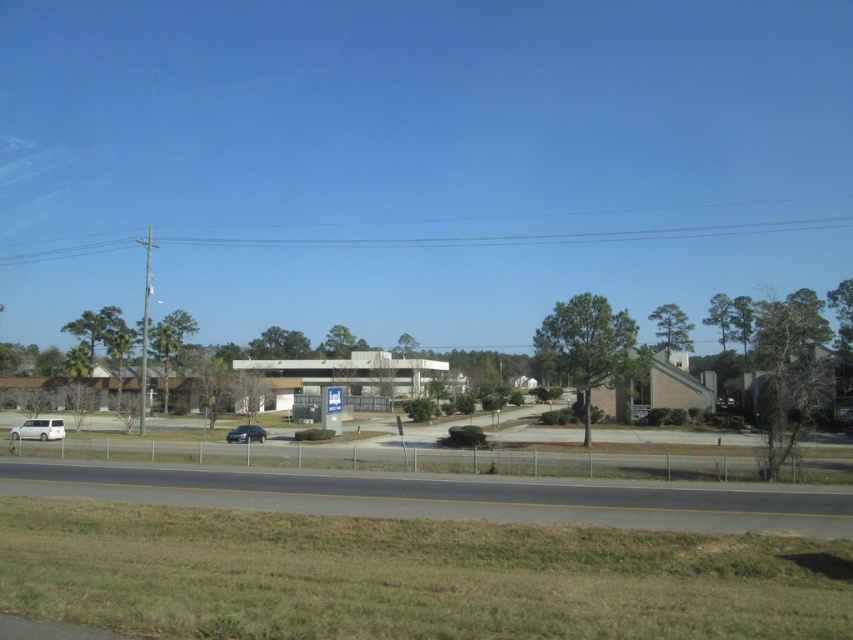
Based on the photo, who is more distant from viewer, (44,426) or (248,440)?

The point (44,426) is more distant.

Is point (22, 420) in front of point (231, 433)?

No, (22, 420) is further to viewer.

Where is `white matte van at lower left`? This screenshot has width=853, height=640. white matte van at lower left is located at coordinates (38, 429).

This screenshot has width=853, height=640. In order to click on white matte van at lower left in this screenshot , I will do `click(38, 429)`.